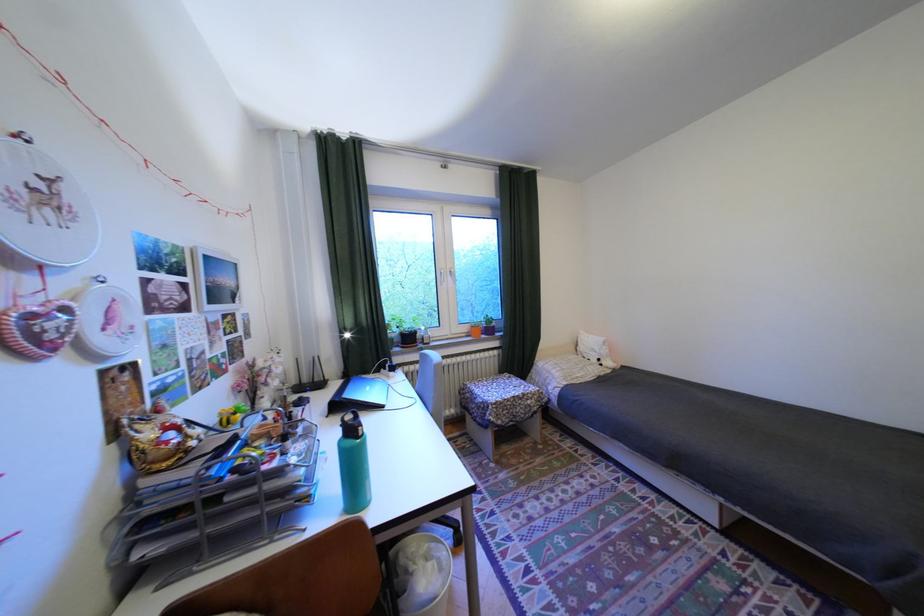
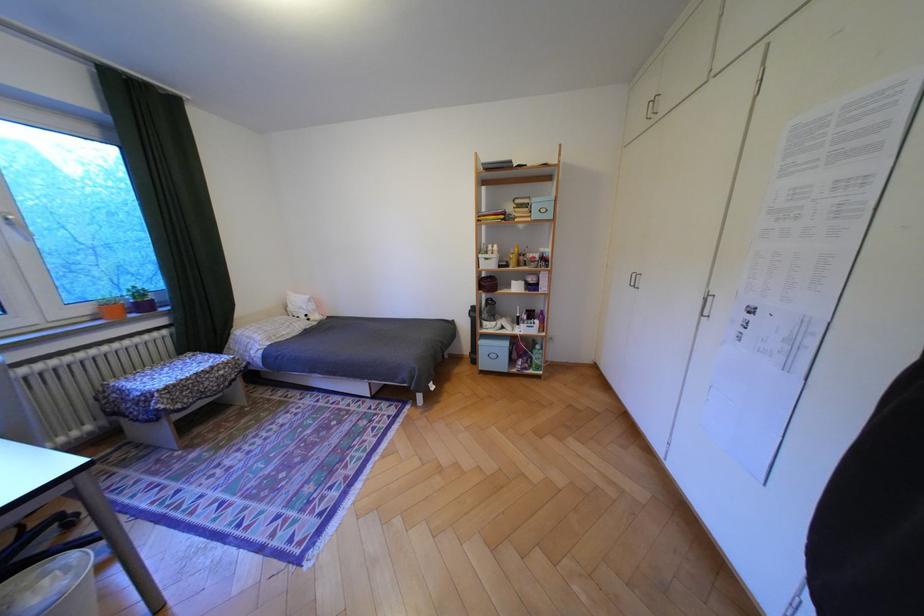
Locate, in the second image, the point that corresponds to point (442, 565) in the first image.

(56, 582)